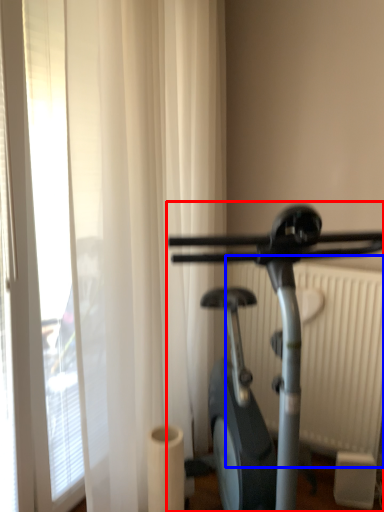
Question: Which object appears closest to the camera in this image, stationary bicycle (highlighted by a red box) or radiator (highlighted by a blue box)?

Choices:
 (A) stationary bicycle
 (B) radiator

Answer: (A)